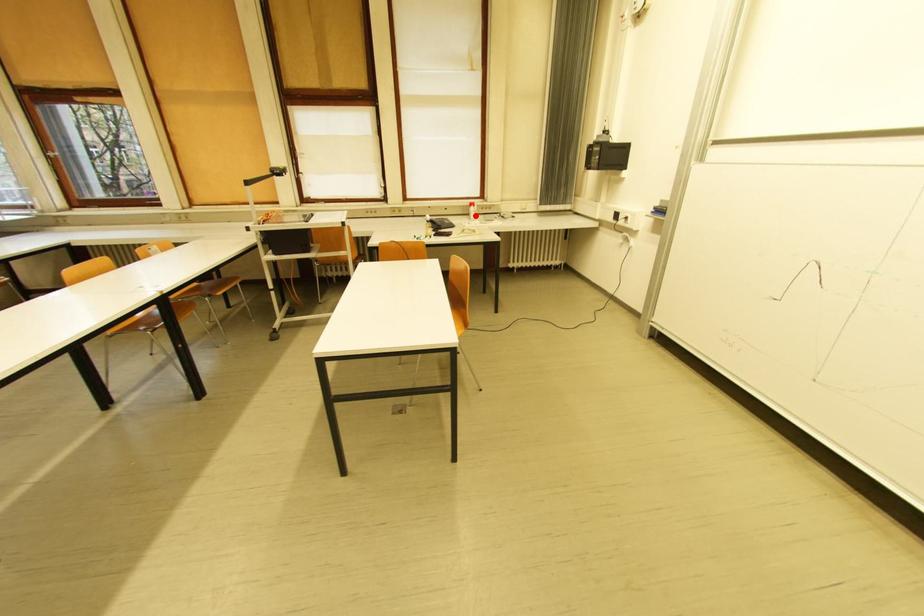
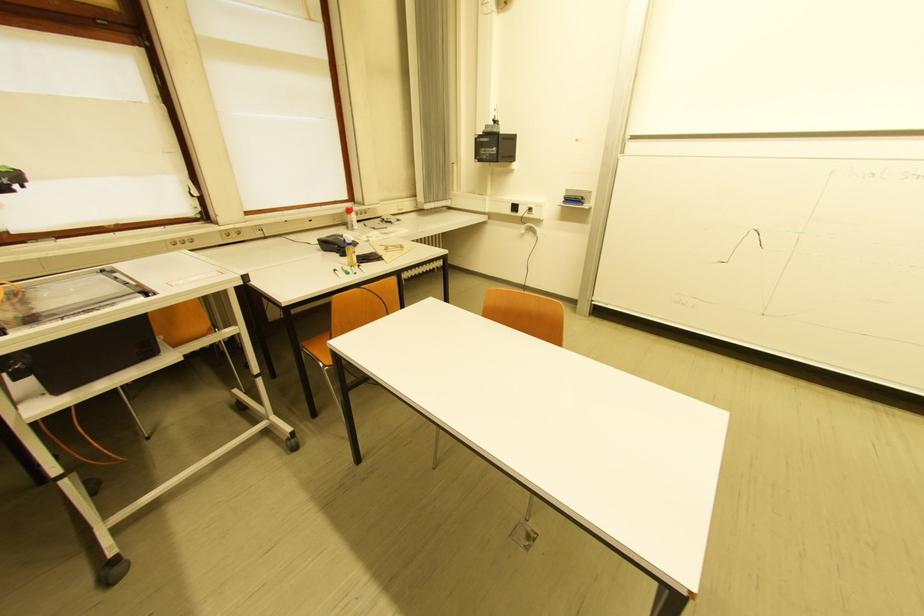
In the second image, find the point that corresponds to the highlighted location in the first image.

(351, 225)